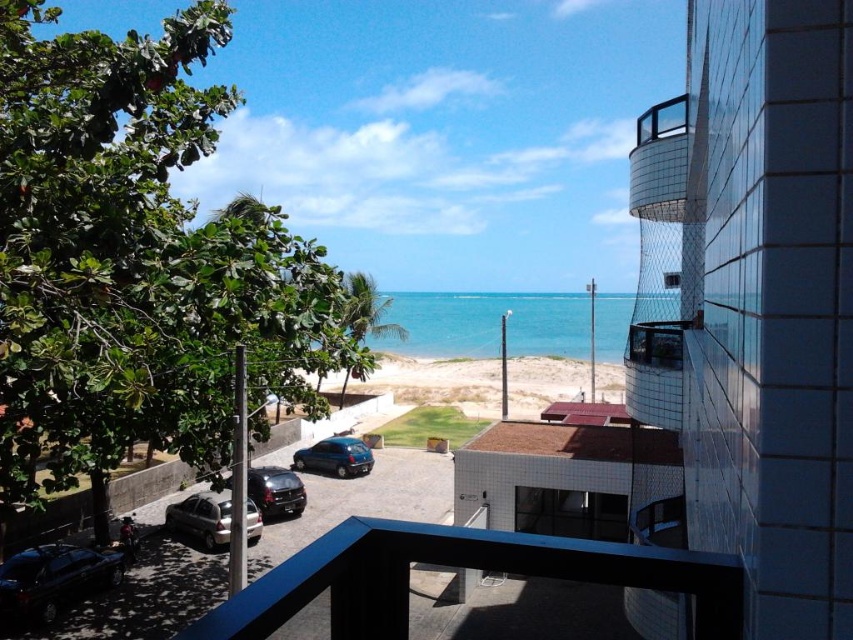
From the picture: You are standing on the glassy metallic balcony at upper right and want to look down at the satin silver car at lower left. Can you see the car from your current position?

Yes, because the glassy metallic balcony at upper right is located above the satin silver car at lower left, you can see the car from your current position.

You are a delivery person trying to park your vehicle, a van that is 6 meters long, in the parking area near the glassy metallic balcony at upper right and the satin silver car at lower left. Can you fit your van between them without overlapping?

The glassy metallic balcony at upper right is wider than the satin silver car at lower left, but the description does not provide specific measurements for the distance between them. Without knowing the exact space available, it is uncertain if the van will fit. Check the actual distance before attempting to park.